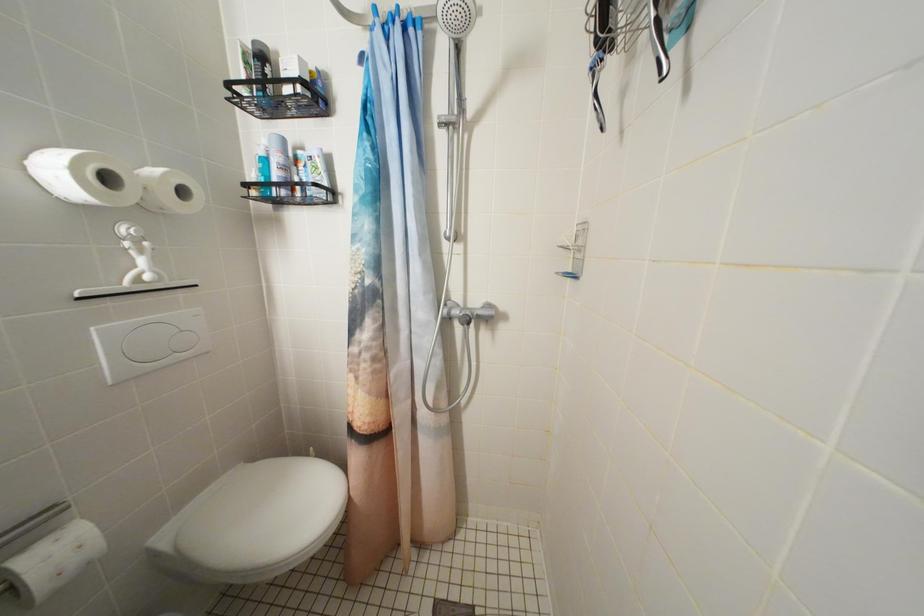
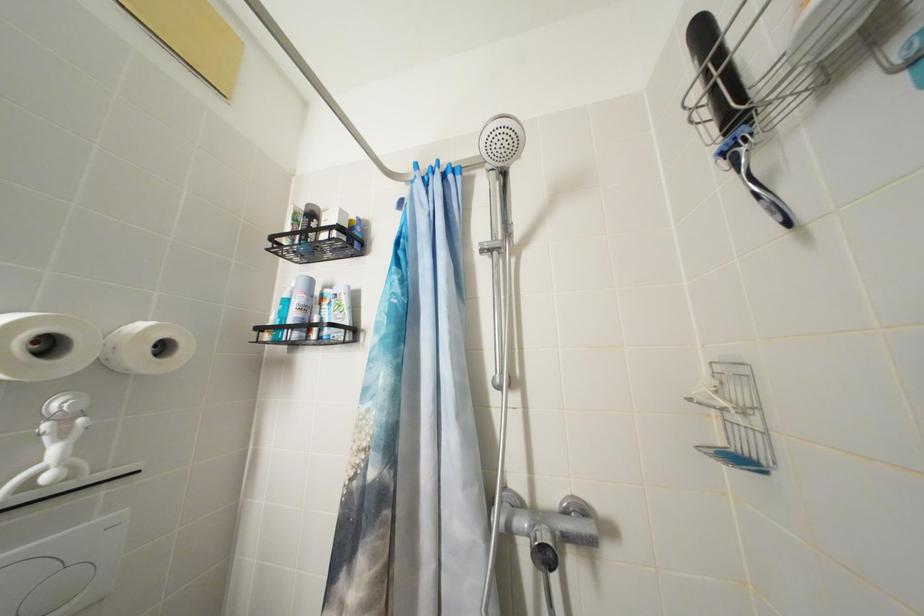
Question: Based on the continuous images, in which direction is the camera rotating? Reply with the corresponding letter.

Choices:
 (A) Left
 (B) Right
 (C) Up
 (D) Down

Answer: (C)